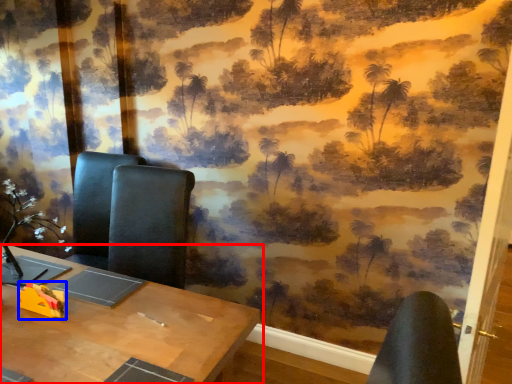
Question: Which point is closer to the camera, table (highlighted by a red box) or toy (highlighted by a blue box)?

Choices:
 (A) table
 (B) toy

Answer: (A)